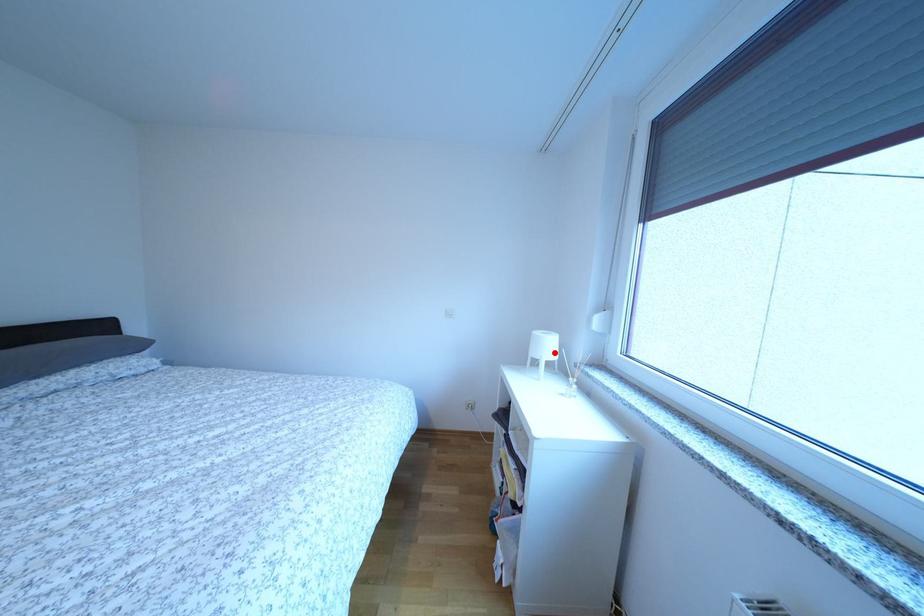
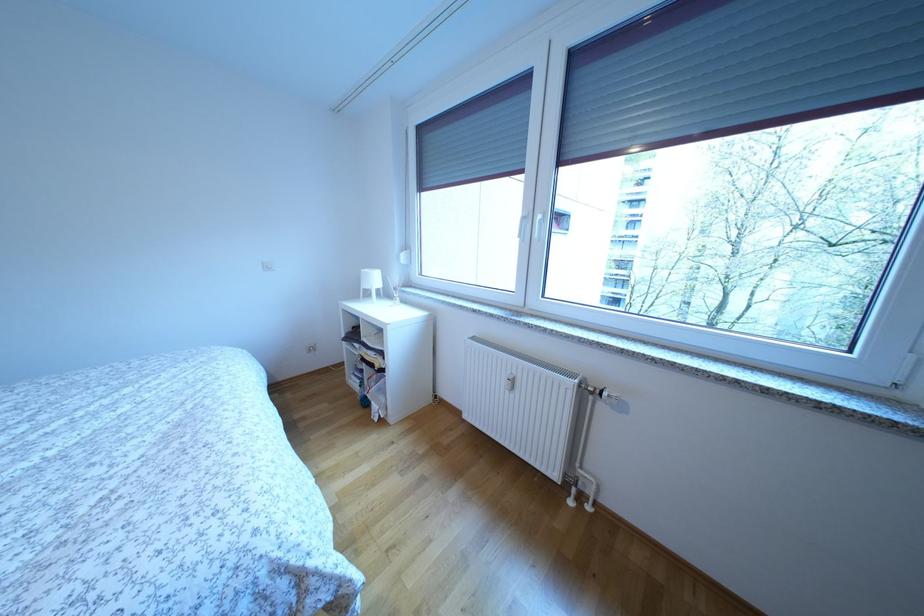
Where in the second image is the point corresponding to the highlighted location from the first image?

(382, 285)